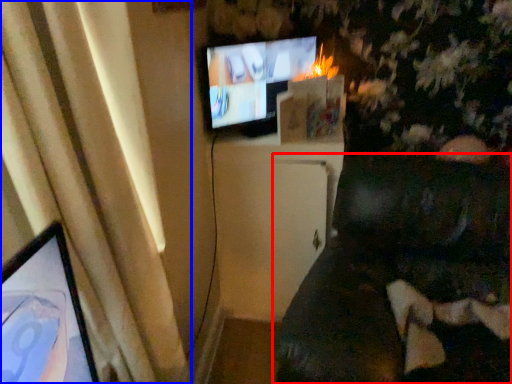
Question: Which object is closer to the camera taking this photo, furniture (highlighted by a red box) or curtain (highlighted by a blue box)?

Choices:
 (A) furniture
 (B) curtain

Answer: (A)